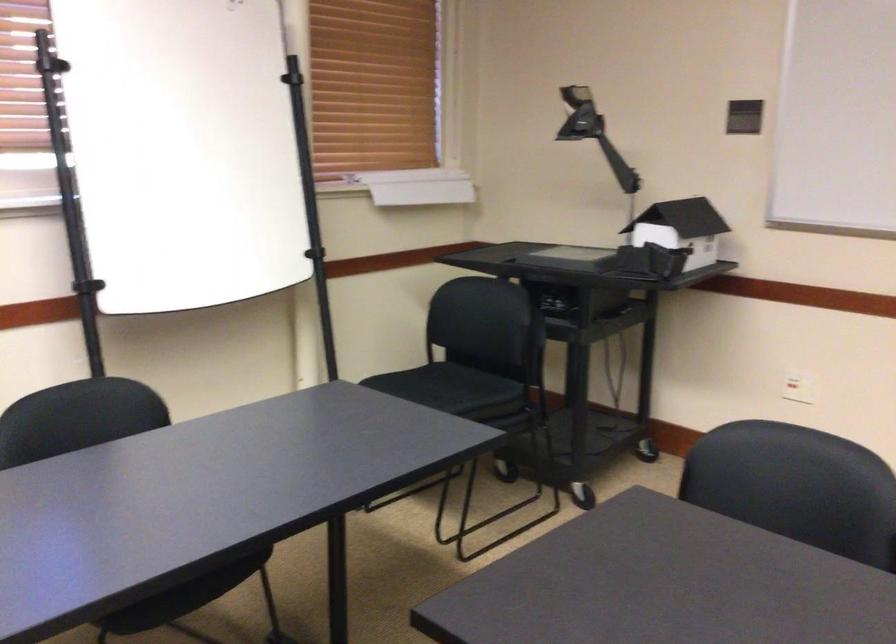
Describe the element at coordinates (635, 279) in the screenshot. This screenshot has height=644, width=896. I see `the black cart handle` at that location.